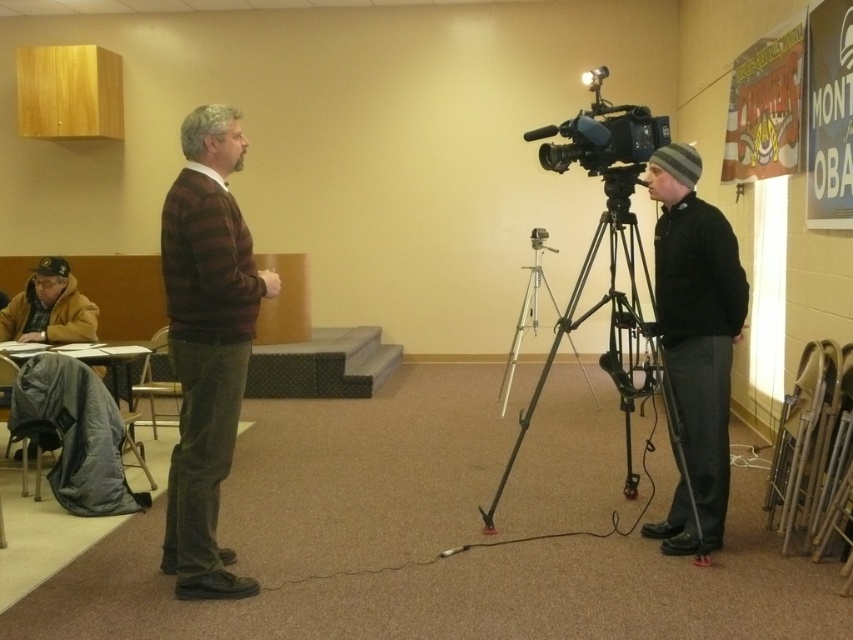
You are a camera operator trying to film a person wearing a black knit beanie at center. The camera you are using has a minimum focus distance of 3 meters. Can you film the person clearly from your current position?

The black knit beanie at center and camera are 3.15 meters apart from each other. Since the minimum focus distance is 3 meters, the camera can focus on the person wearing the black knit beanie at center as the distance is within the required range.

You are standing in the room and want to move from the point at coordinates point (689, 152) to the point at coordinates point (601, 115). Which direction should you move?

You should move backward because point (689, 152) is in front of point (601, 115).

You are a photographer trying to capture the perfect shot of the interview. You notice the black knit beanie at center and the black plastic camera at center. Which object is located lower in the frame?

The black knit beanie at center is positioned under the black plastic camera at center, so it is located lower in the frame.